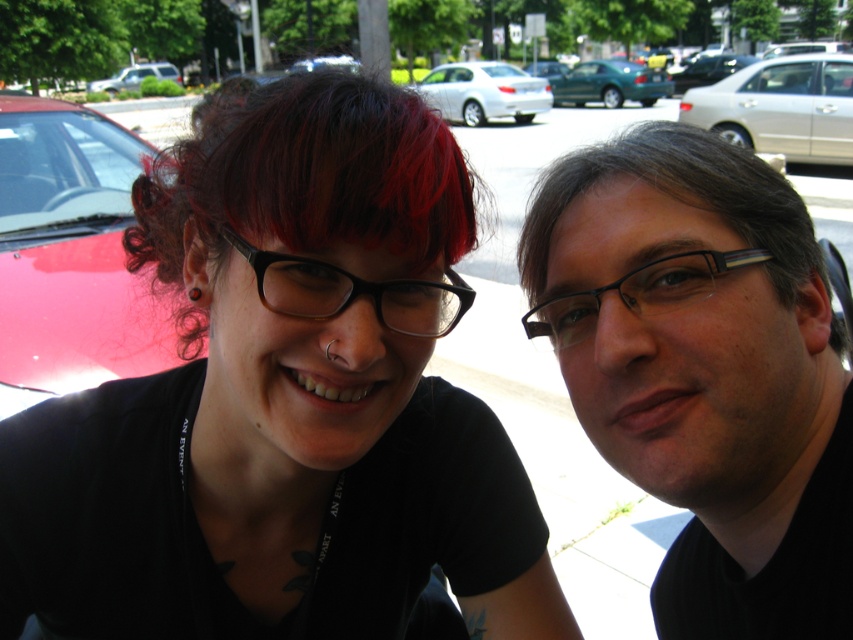
Question: Which of the following is the farthest from the observer?

Choices:
 (A) (643, 88)
 (B) (711, 275)

Answer: (A)

Question: Which point is closer to the camera taking this photo?

Choices:
 (A) (705, 273)
 (B) (653, 83)

Answer: (A)

Question: Considering the relative positions of black matte hair at center and silver metallic sedan at right in the image provided, where is black matte hair at center located with respect to silver metallic sedan at right?

Choices:
 (A) left
 (B) right

Answer: (A)

Question: Is black matte hair at center further to the viewer compared to silver metallic sedan at center?

Choices:
 (A) no
 (B) yes

Answer: (A)

Question: Among these points, which one is nearest to the camera?

Choices:
 (A) (714, 74)
 (B) (619, 80)

Answer: (B)

Question: From the image, what is the correct spatial relationship of shiny red hair at center in relation to black plastic glasses at center?

Choices:
 (A) above
 (B) below

Answer: (A)